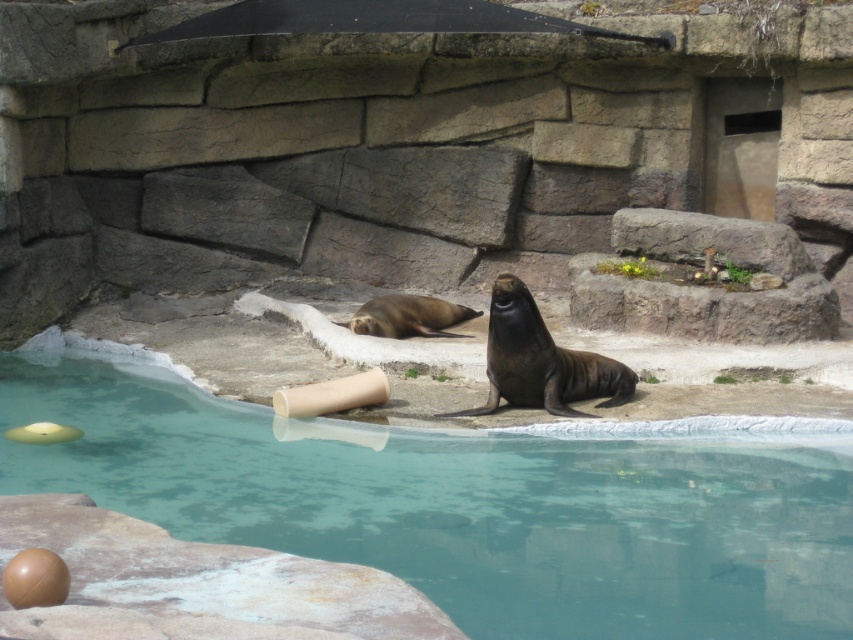
You are a zookeeper trying to clean the transparent glass swimming pool at lower center and the beige cardboard tube at center. Which object should you clean first if you want to start with the one nearest to you?

You should clean the transparent glass swimming pool at lower center first because it is closer to the viewer than the beige cardboard tube at center.

You are a zookeeper preparing to clean the enclosure. You need to move the beige cardboard tube at center to the storage area. However, you must ensure that the tube does not block the transparent glass swimming pool at lower center. Based on their sizes, can you safely move the tube without obstructing the pool?

The transparent glass swimming pool at lower center might be wider than beige cardboard tube at center, so there is a possibility that the tube won not block the pool if moved carefully. However, since the exact width difference is uncertain, it is advisable to move the tube to a position where it does not interfere with the pool.